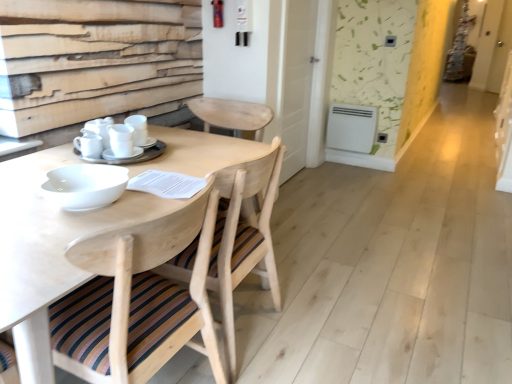
Question: In terms of size, does natural wood chair at center, the 1th chair from the front, appear bigger or smaller than white matte cups at center, placed as the second tableware when sorted from right to left?

Choices:
 (A) big
 (B) small

Answer: (A)

Question: Considering the positions of natural wood chair at center, the 1th chair from the front, and white matte cups at center, placed as the second tableware when sorted from right to left, in the image, is natural wood chair at center, the 1th chair from the front, taller or shorter than white matte cups at center, placed as the second tableware when sorted from right to left,?

Choices:
 (A) short
 (B) tall

Answer: (B)

Question: Considering the real-world distances, which object is closest to the natural wood chair at center, the 1th chair from the front?

Choices:
 (A) white plastic radiator at center
 (B) white matte cups at center, placed as the second tableware when sorted from right to left
 (C) white matte cups at center, which ranks as the 3th tableware in left-to-right order
 (D) natural wood chair at center, which is the second chair from front to back
 (E) natural wood round table at center

Answer: (D)

Question: Considering the real-world distances, which object is closest to the natural wood chair at center, which is the first chair from back to front?

Choices:
 (A) natural wood round table at center
 (B) white glossy cup at center, placed as the 1th tableware when sorted from left to right
 (C) white matte cups at center, which ranks as the 3th tableware in left-to-right order
 (D) white matte cups at center, placed as the second tableware when sorted from right to left
 (E) white glossy screen door at upper right

Answer: (A)